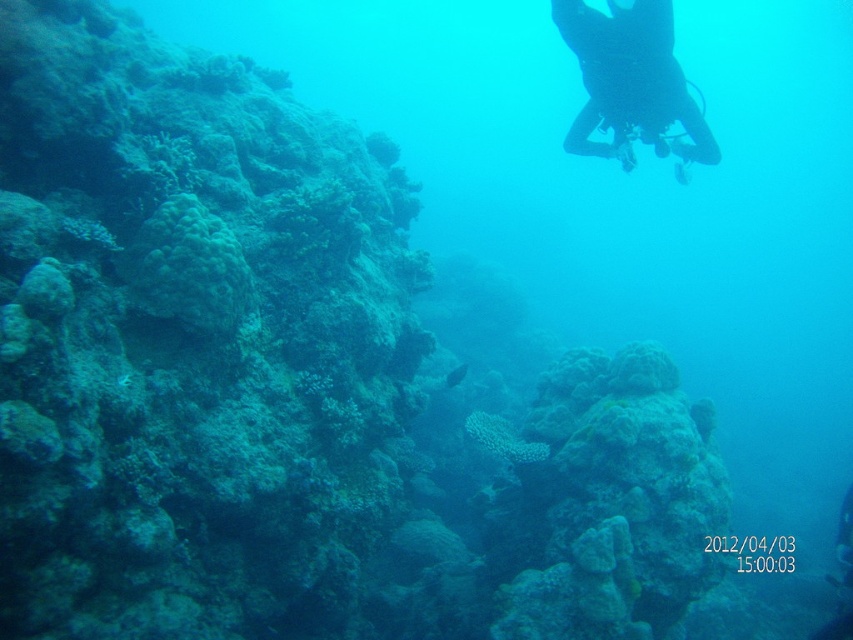
Question: In this image, where is black matte scuba diver at upper center located relative to green matte coral at left?

Choices:
 (A) below
 (B) above

Answer: (B)

Question: Which point appears farthest from the camera in this image?

Choices:
 (A) (173, 272)
 (B) (604, 125)

Answer: (B)

Question: Which object is closer to the camera taking this photo?

Choices:
 (A) green matte coral at left
 (B) black matte scuba diver at upper center

Answer: (A)

Question: Is black matte scuba diver at upper center below green matte coral at left?

Choices:
 (A) yes
 (B) no

Answer: (B)

Question: Does black matte scuba diver at upper center have a lesser width compared to green matte coral at left?

Choices:
 (A) yes
 (B) no

Answer: (B)